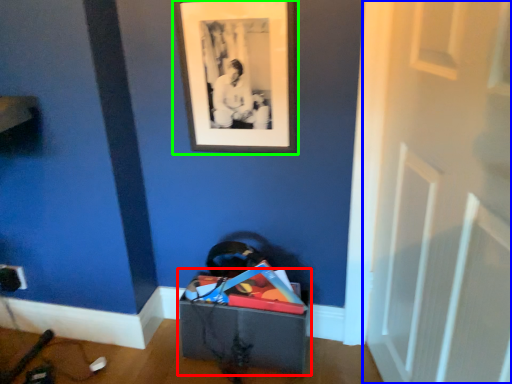
Question: Which object is positioned closest to storage box (highlighted by a red box)? Select from door (highlighted by a blue box) and picture frame (highlighted by a green box).

Choices:
 (A) door
 (B) picture frame

Answer: (A)